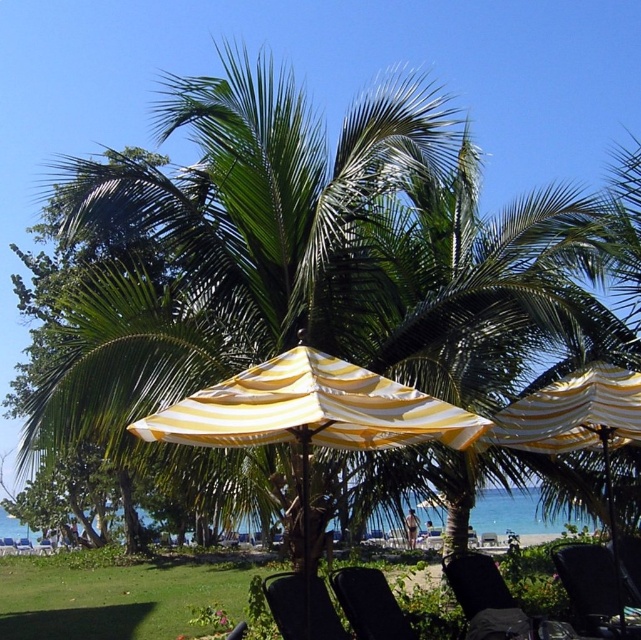
You are a beachgoer who wants to find shade. You see the yellow striped umbrella at center and the black plastic chair at lower center. Which object is located to the right of the other?

The yellow striped umbrella at center is positioned on the right side of black plastic chair at lower center.

You are a beachgoer who wants to know if you can place a 1.5 meter tall cooler between the yellow striped umbrella at center and the black fabric chair at lower right. Can you do this without the cooler touching either object?

The yellow striped umbrella at center is taller than the black fabric chair at lower right. Since the cooler is 1.5 meters tall, it may interfere with the height of the umbrella but not the chair. However, the question specifies placing it between them without touching, which primarily concerns horizontal space. The height difference alone doesn